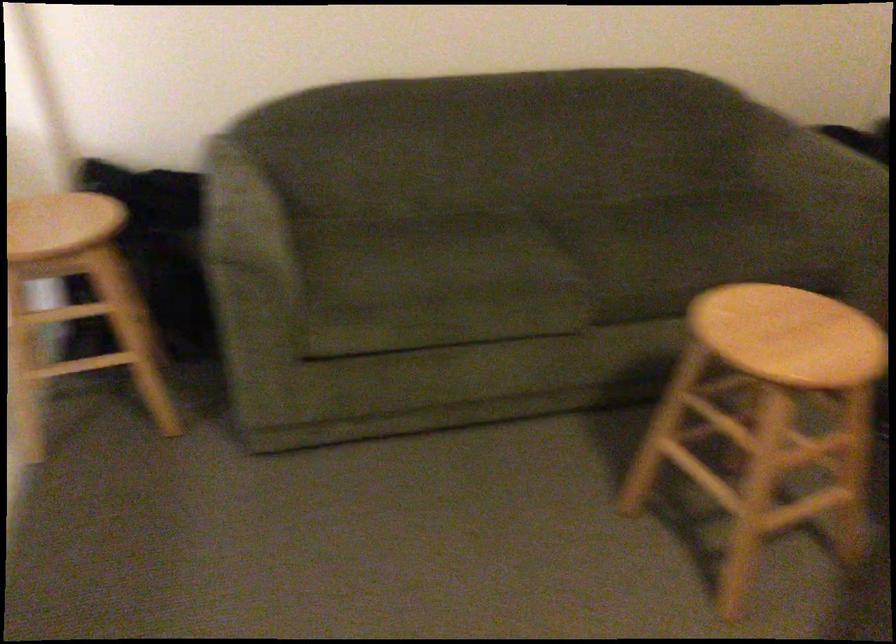
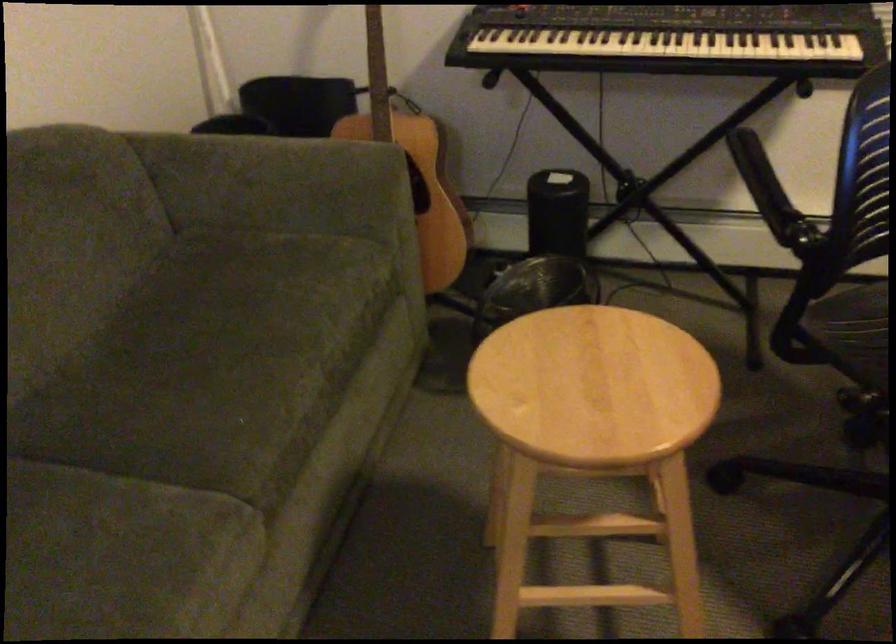
Locate, in the second image, the point that corresponds to point 788,337 in the first image.

(593, 386)